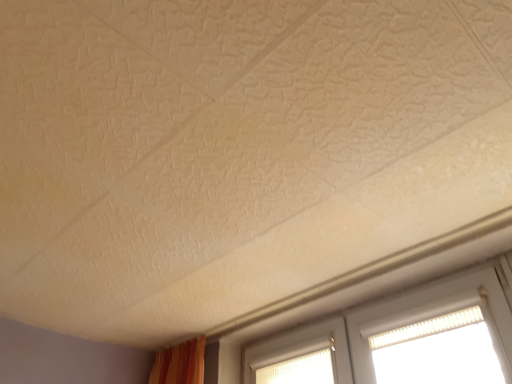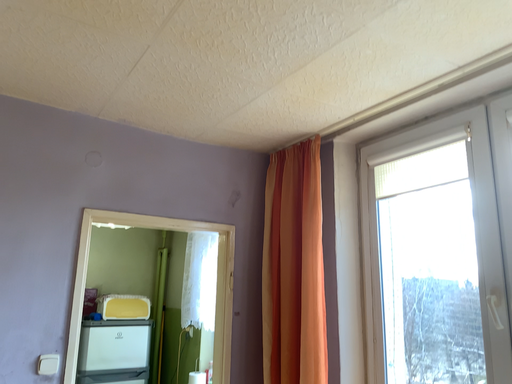
Question: Which way did the camera rotate in the video?

Choices:
 (A) rotated right
 (B) rotated left

Answer: (B)